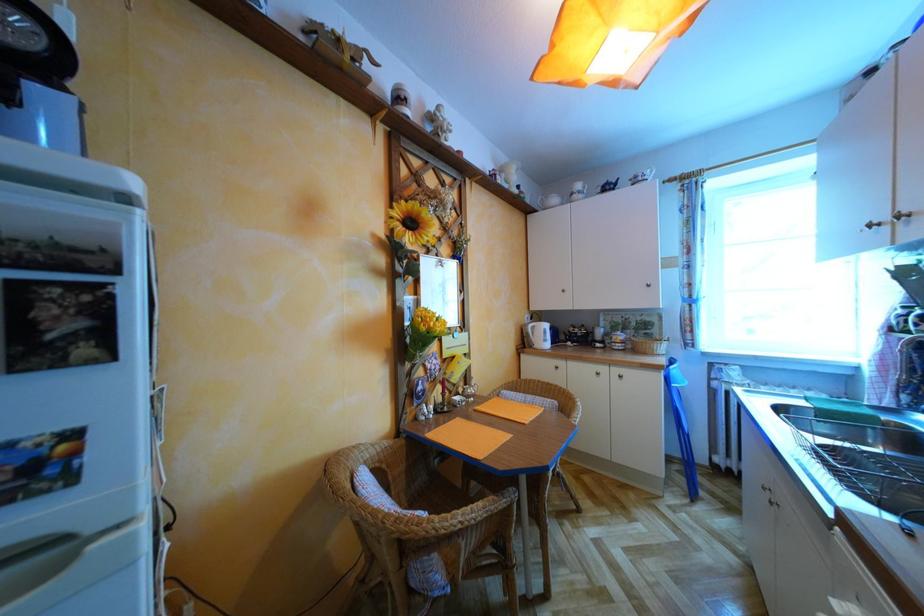
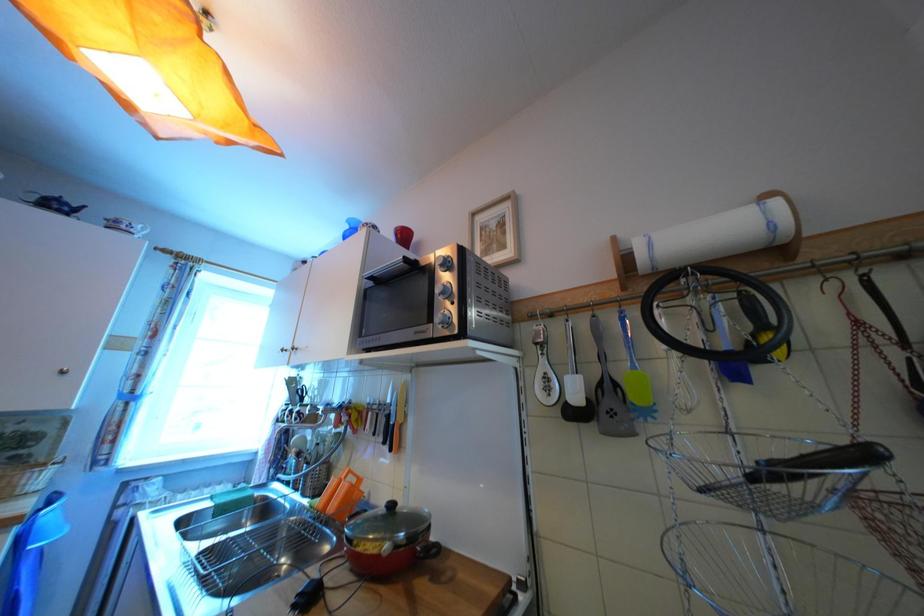
The first image is from the beginning of the video and the second image is from the end. How did the camera likely rotate when shooting the video?

The camera rotated toward right-up.